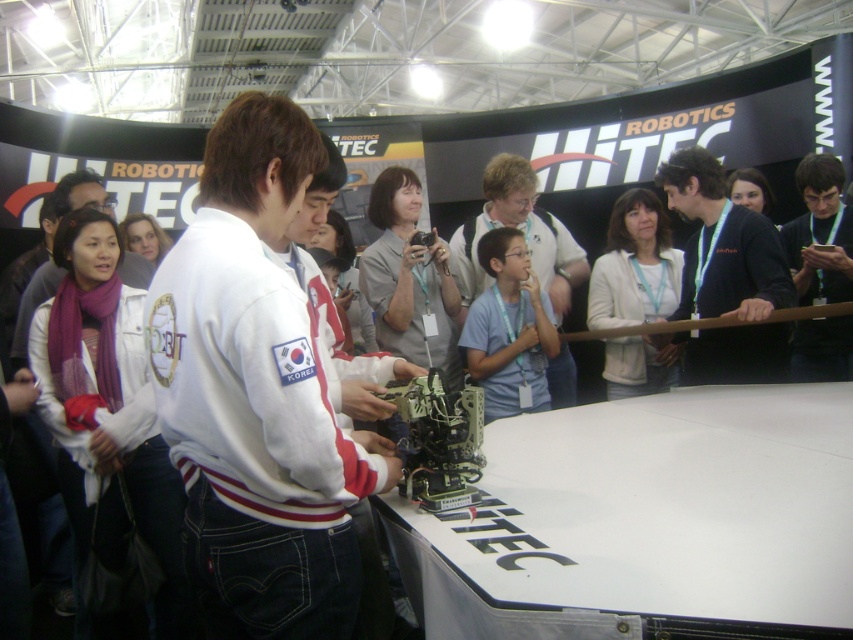
How much distance is there between black fabric at center and white cotton jacket at center?

They are 6.85 feet apart.

Is point (692, 369) positioned after point (123, 278)?

Yes, point (692, 369) is behind point (123, 278).

Where is `black fabric at center`? black fabric at center is located at coordinates (723, 244).

Does black fabric at center have a larger size compared to black matte shirt at upper right?

Yes, black fabric at center is bigger than black matte shirt at upper right.

Between black fabric at center and black matte shirt at upper right, which one appears on the left side from the viewer's perspective?

black fabric at center is more to the left.

Identify the location of black fabric at center. This screenshot has height=640, width=853. (723, 244).

Is point (250, 477) less distant than point (703, 372)?

Yes, it is.

Locate an element on the screen. white fleece jacket at center is located at coordinates (257, 396).

At what (x,y) coordinates should I click in order to perform the action: click on white fleece jacket at center. Please return your answer as a coordinate pair (x, y). This screenshot has height=640, width=853. Looking at the image, I should click on pos(257,396).